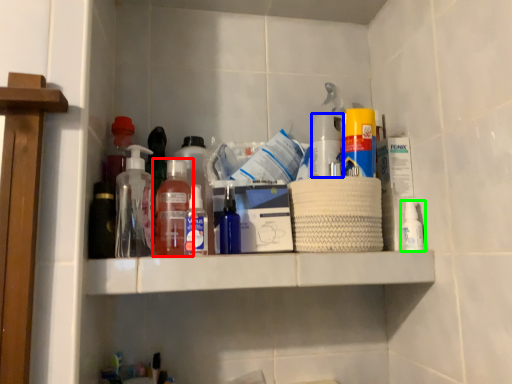
Question: Which is nearer to the bottle (highlighted by a red box)? bottle (highlighted by a blue box) or bottle (highlighted by a green box).

Choices:
 (A) bottle
 (B) bottle

Answer: (A)